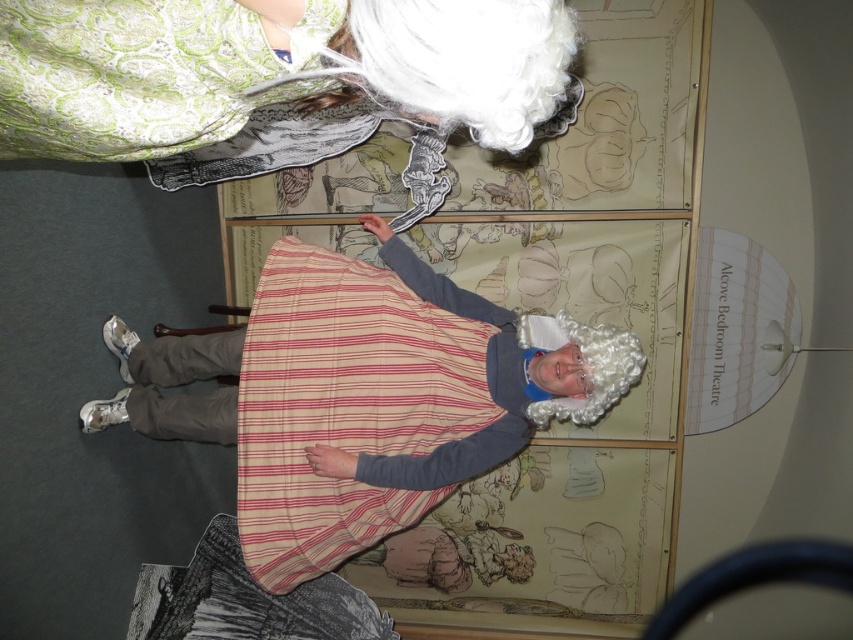
You are an event organizer planning to add a decorative banner above the matte white wig at upper center and the striped cotton apron at center. Which object requires a larger banner to cover its width?

The striped cotton apron at center requires a larger banner since it is wider than the matte white wig at upper center.

You are a costume designer standing 1 meter away from the matte white wig at upper center. You need to adjust its position to ensure it stays securely on the performer. Is the current distance sufficient for you to comfortably reach and adjust the wig without moving closer?

The distance between the matte white wig at upper center and the viewer is 68.64 centimeters. Since the costume designer is standing 1 meter away, which is approximately 100 centimeters, the wig is within comfortable reach. Therefore, the current distance allows for adjustments without needing to move closer.

From the picture: You are an event planner setting up a historical reenactment stage. You need to ensure that the matte white wig at upper center and the striped cotton apron at center are visible to the audience. Based on their heights, which object should be placed closer to the front of the stage to ensure visibility?

The matte white wig at upper center should be placed closer to the front of the stage because it is shorter than the striped cotton apron at center, allowing both objects to be seen clearly by the audience.